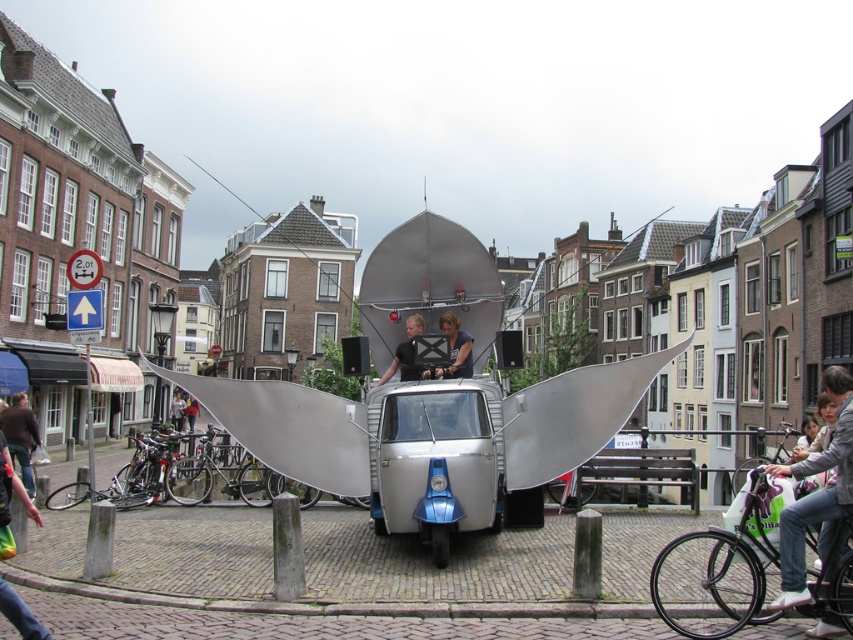
You are standing on the street looking at the unusual vehicle with wings. There are two points marked on the vehicle. Which point is closer to you, point (x=0, y=426) or point (x=189, y=413)?

Point (x=0, y=426) is closer to the viewer than point (x=189, y=413).